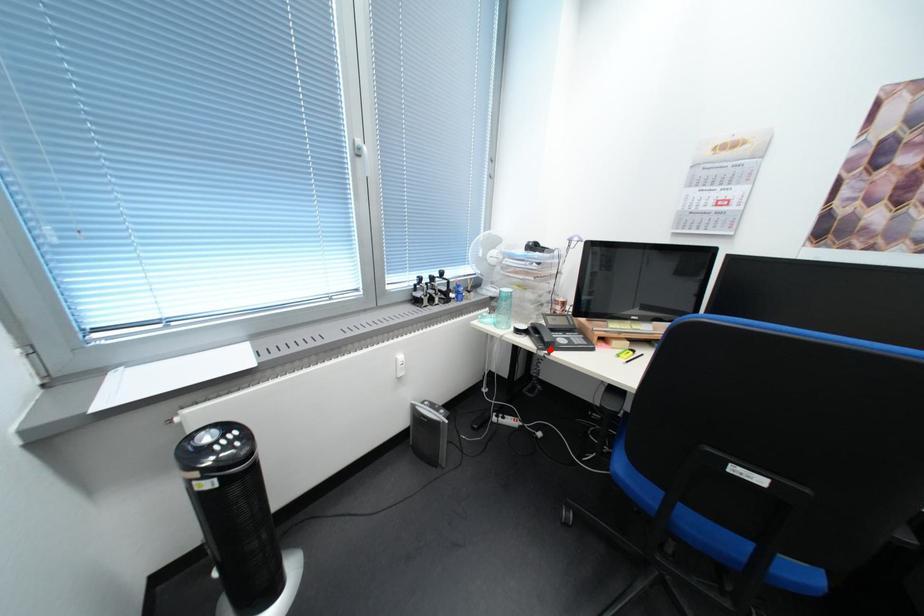
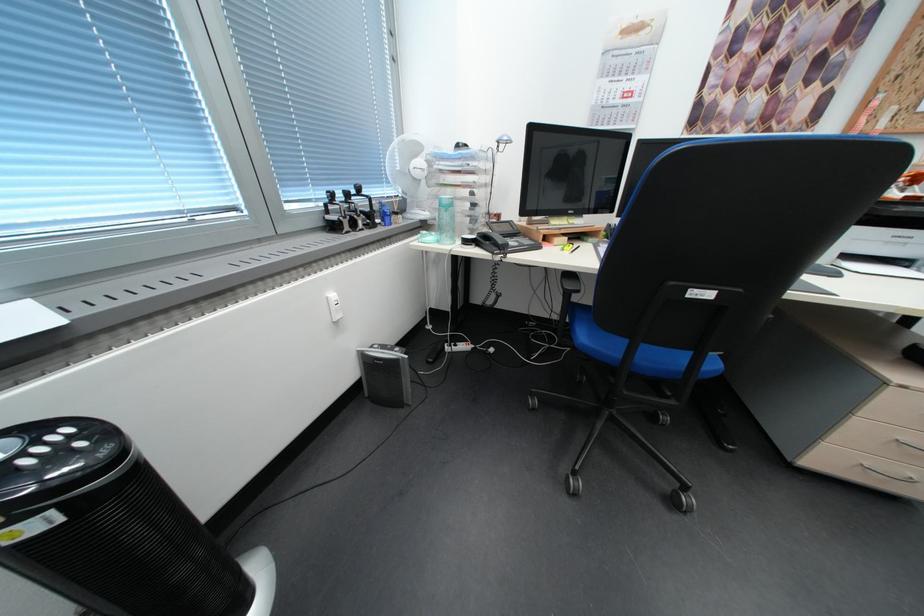
Where in the second image is the point corresponding to the highlighted location from the first image?

(505, 254)